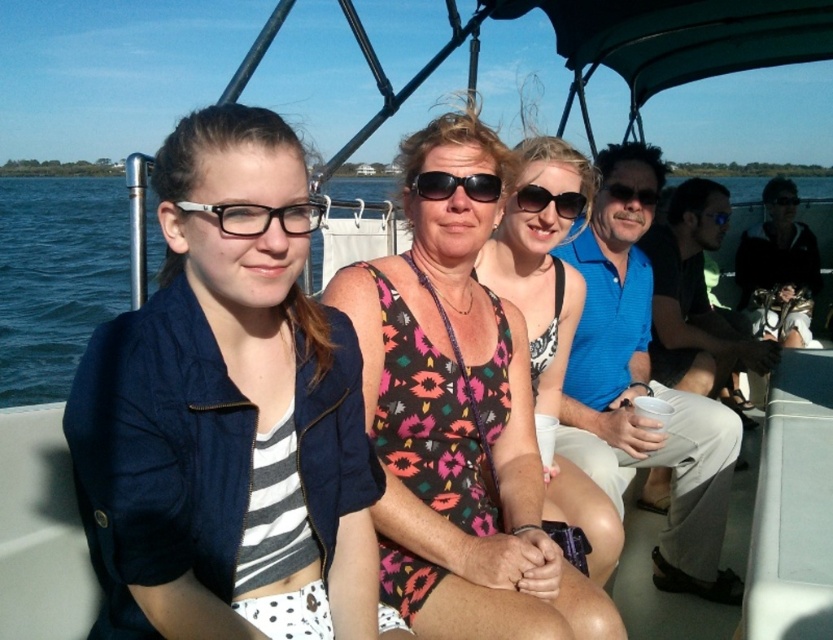
Describe the element at coordinates (258, 216) in the screenshot. I see `matte black glasses at upper left` at that location.

How distant is matte black glasses at upper left from black plastic goggles at upper right?

matte black glasses at upper left is 22.32 feet away from black plastic goggles at upper right.

Is point (232, 224) less distant than point (791, 195)?

Yes, point (232, 224) is in front of point (791, 195).

You are a GUI agent. You are given a task and a screenshot of the screen. Output one action in this format:
    pyautogui.click(x=<x>, y=<y>)
    Task: Click on the matte black glasses at upper left
    
    Given the screenshot: What is the action you would take?
    pyautogui.click(x=258, y=216)

Is point (115, 186) positioned before point (706, 216)?

No.

Is point (13, 385) more distant than point (721, 216)?

That is True.

You are a GUI agent. You are given a task and a screenshot of the screen. Output one action in this format:
    pyautogui.click(x=<x>, y=<y>)
    Task: Click on the clear blue water at upper left
    
    Given the screenshot: What is the action you would take?
    pyautogui.click(x=56, y=276)

Which is more to the left, floral print tank top at center or black plastic sunglasses at center?

black plastic sunglasses at center is more to the left.

Find the location of `floral print tank top at center`. floral print tank top at center is located at coordinates (551, 332).